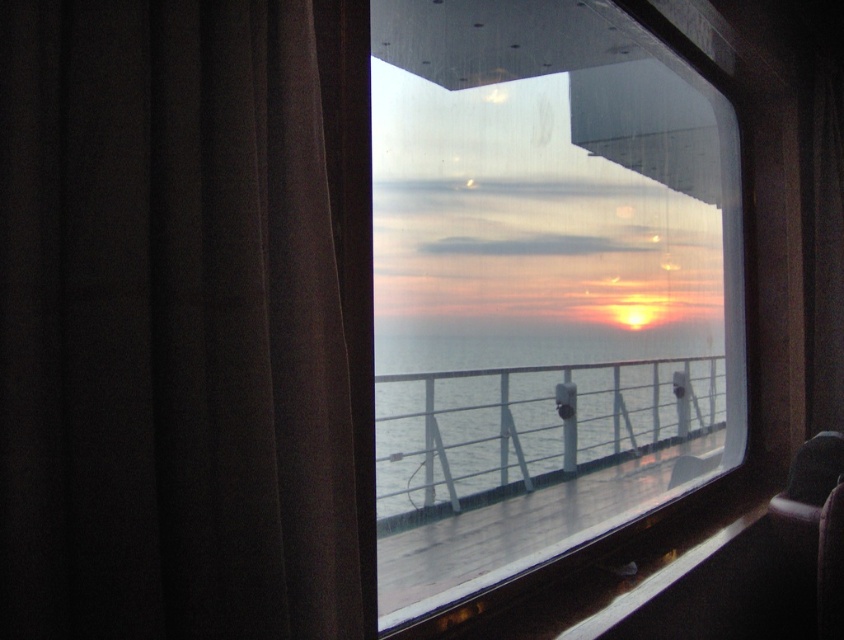
Question: Is brown fabric curtain at left thinner than clear water at center?

Choices:
 (A) yes
 (B) no

Answer: (A)

Question: Which of the following is the closest to the observer?

Choices:
 (A) (388, 468)
 (B) (293, 118)
 (C) (441, 134)

Answer: (B)

Question: Can you confirm if brown fabric curtain at left is positioned above transparent glass window at center?

Choices:
 (A) yes
 (B) no

Answer: (B)

Question: Is brown fabric curtain at left closer to camera compared to transparent glass window at center?

Choices:
 (A) no
 (B) yes

Answer: (B)

Question: Estimate the real-world distances between objects in this image. Which object is closer to the brown fabric curtain at left?

Choices:
 (A) clear water at center
 (B) transparent glass window at center

Answer: (A)

Question: Among these objects, which one is farthest from the camera?

Choices:
 (A) brown fabric curtain at left
 (B) transparent glass window at center
 (C) clear water at center

Answer: (B)